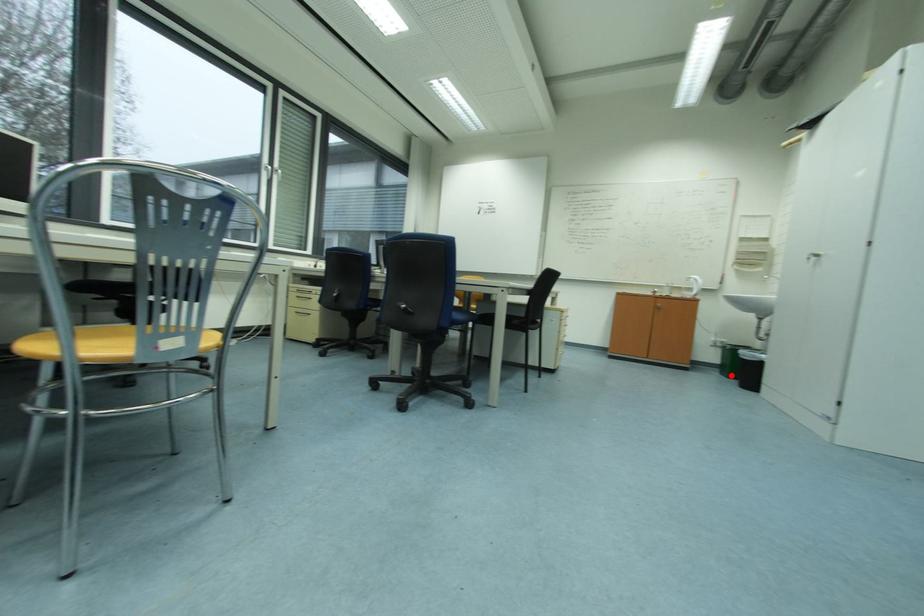
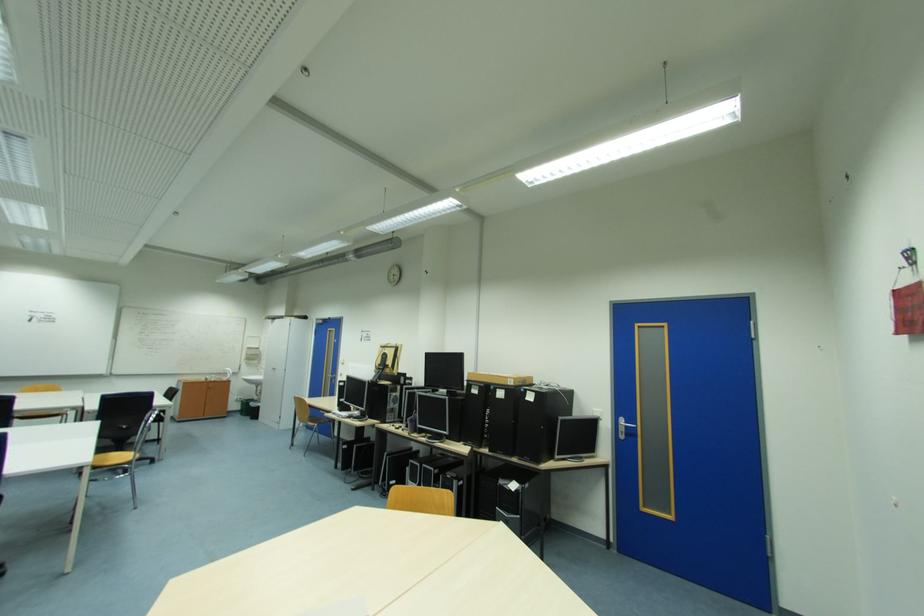
Locate, in the second image, the point that corresponds to the highlighted location in the first image.

(249, 416)